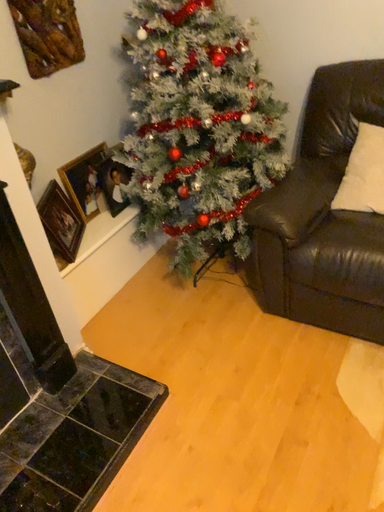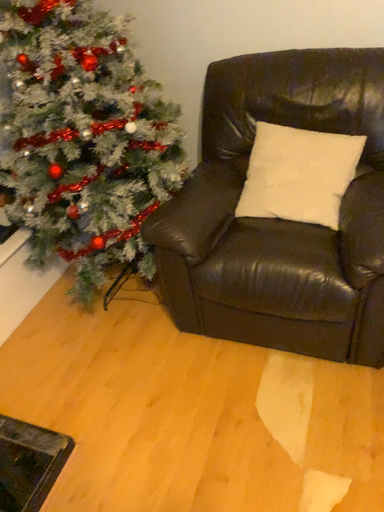
Question: How did the camera likely rotate when shooting the video?

Choices:
 (A) rotated right
 (B) rotated left

Answer: (A)